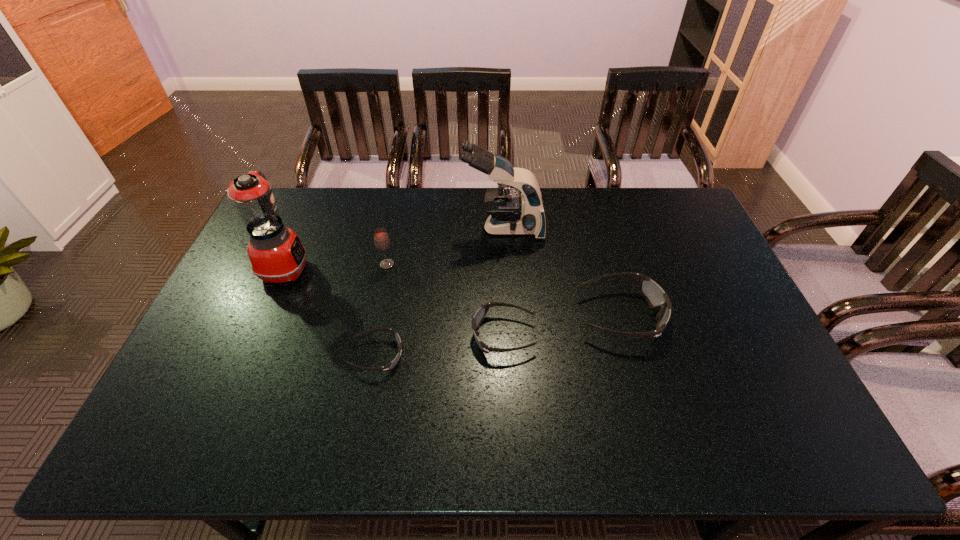
Where is `object that is at the near edge`? The height and width of the screenshot is (540, 960). object that is at the near edge is located at coordinates (390, 365).

Locate an element on the screen. object that is at the left edge is located at coordinates (276, 254).

Find the location of a particular element. vacant area at the far edge is located at coordinates (381, 212).

You are a GUI agent. You are given a task and a screenshot of the screen. Output one action in this format:
    pyautogui.click(x=<x>, y=<y>)
    Task: Click on the vacant space at the near edge
    This screenshot has height=540, width=960.
    Given the screenshot: What is the action you would take?
    pyautogui.click(x=533, y=380)

This screenshot has height=540, width=960. In the image, there is a desktop. What are the coordinates of `free space at the left edge` in the screenshot? It's located at (269, 286).

This screenshot has width=960, height=540. In the image, there is a desktop. Identify the location of vacant space at the right edge. (704, 229).

Where is `empty space between the rightmost sunglasses and the microscope`? empty space between the rightmost sunglasses and the microscope is located at coordinates (562, 272).

The width and height of the screenshot is (960, 540). In order to click on free space between the glass drink container and the farthest object in this screenshot , I will do `click(445, 246)`.

At what (x,y) coordinates should I click in order to perform the action: click on free space between the leftmost object and the farthest object. Please return your answer as a coordinate pair (x, y). This screenshot has height=540, width=960. Looking at the image, I should click on click(395, 248).

The height and width of the screenshot is (540, 960). Identify the location of free space that is in between the second shortest object and the leftmost sunglasses. (441, 345).